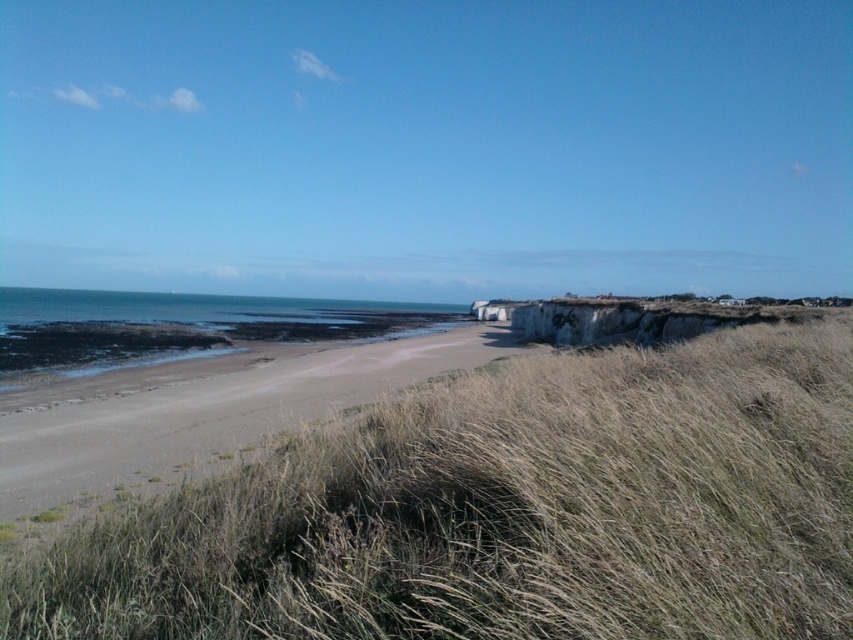
You are standing on the beach and want to walk to the white stone cliff at right. Which direction should you move relative to the dry grass at lower right?

You should move towards the upper direction relative to the dry grass at lower right because the white stone cliff at right is above it.